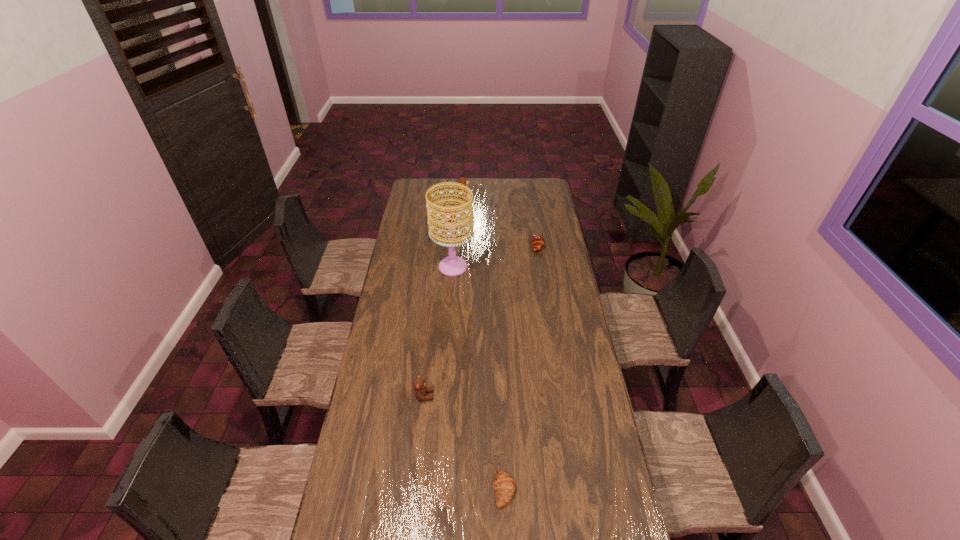
The height and width of the screenshot is (540, 960). Identify the location of empty space that is in between the rightmost object and the left teddy bear. (481, 320).

The height and width of the screenshot is (540, 960). Identify the location of vacant area between the farther crescent roll and the farthest object. (501, 219).

Where is `free space between the left teddy bear and the right crescent roll`? Image resolution: width=960 pixels, height=540 pixels. free space between the left teddy bear and the right crescent roll is located at coordinates [x=481, y=320].

Identify the location of free space between the left teddy bear and the second object from right to left. The width and height of the screenshot is (960, 540). (464, 443).

Locate an element on the screen. The image size is (960, 540). empty space between the right crescent roll and the left teddy bear is located at coordinates tap(481, 320).

Find the location of a particular element. vacant space in between the lampshade and the nearer teddy bear is located at coordinates (439, 331).

Locate an element on the screen. vacant space that is in between the rightmost object and the fourth farthest object is located at coordinates (481, 320).

You are a GUI agent. You are given a task and a screenshot of the screen. Output one action in this format:
    pyautogui.click(x=<x>, y=<y>)
    Task: Click on the empty space between the left crescent roll and the tallest object
    
    Given the screenshot: What is the action you would take?
    pyautogui.click(x=478, y=378)

What are the coordinates of `object that is the second closest one to the farther crescent roll` in the screenshot? It's located at (462, 180).

Identify which object is located as the nearest to the left crescent roll. Please provide its 2D coordinates. Your answer should be formatted as a tuple, i.e. [(x, y)], where the tuple contains the x and y coordinates of a point satisfying the conditions above.

[(421, 389)]